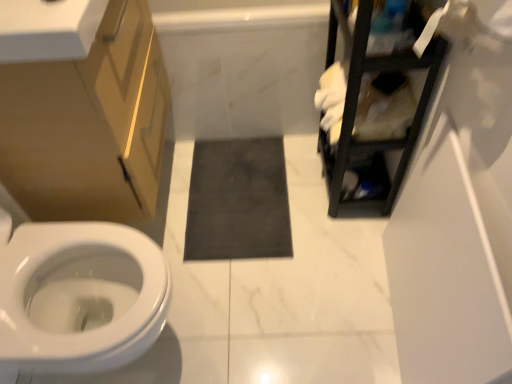
This screenshot has height=384, width=512. Find the location of `vacant space that is in between matte gold cabinet at left and black metal shelving unit at upper right`. vacant space that is in between matte gold cabinet at left and black metal shelving unit at upper right is located at coordinates (255, 200).